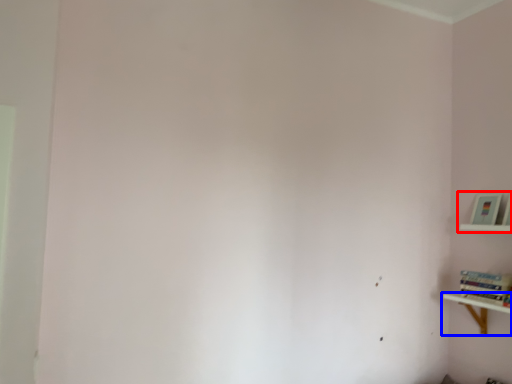
Question: Which of the following is the farthest to the observer, shelf (highlighted by a red box) or shelf (highlighted by a blue box)?

Choices:
 (A) shelf
 (B) shelf

Answer: (A)